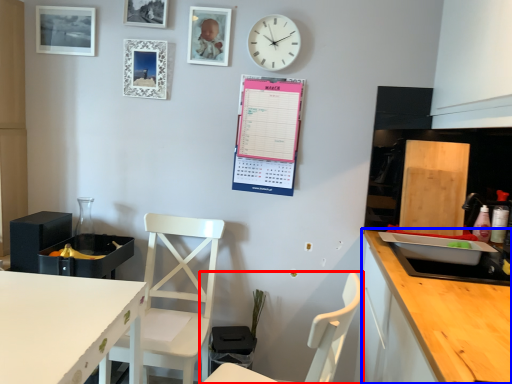
Question: Which object appears farthest to the camera in this image, chair (highlighted by a red box) or cabinetry (highlighted by a blue box)?

Choices:
 (A) chair
 (B) cabinetry

Answer: (B)